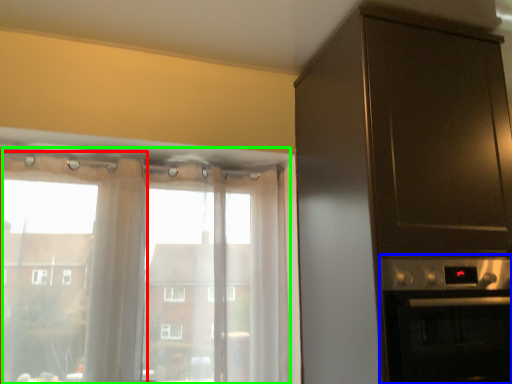
Question: Based on their relative distances, which object is nearer to curtain (highlighted by a red box)? Choose from appliance (highlighted by a blue box) and window (highlighted by a green box).

Choices:
 (A) appliance
 (B) window

Answer: (B)